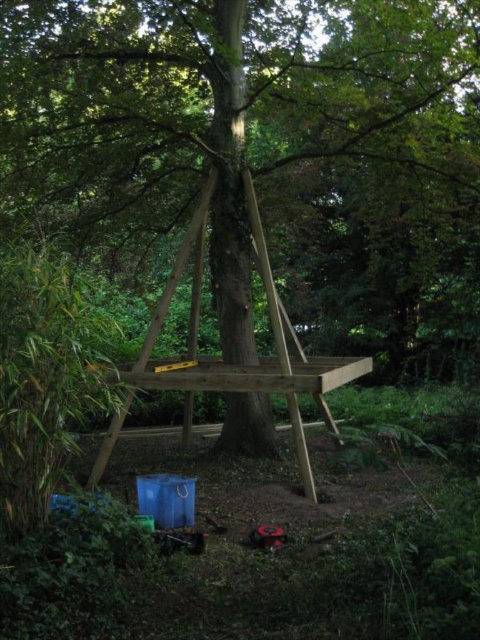
You are planning to set up a small campsite in the forest and have both the natural wood ladder at center and the wooden picnic table at center available. Which object should you prioritize placing first if you want to ensure there is enough space for both?

The natural wood ladder at center is bigger than the wooden picnic table at center, so you should prioritize placing the natural wood ladder at center first to ensure there is enough space for both.

You are standing in front of the rustic wooden structure built around the tree trunk. You notice two points marked on the structure. The first point is at coordinates point [156,131] and the second point is at point [245,378]. If you were to walk towards the structure, which point would you encounter first?

Point [156,131] is further to the camera than point [245,378]. Therefore, when approaching the structure, you would encounter point [156,131] first since it is closer to your starting position.